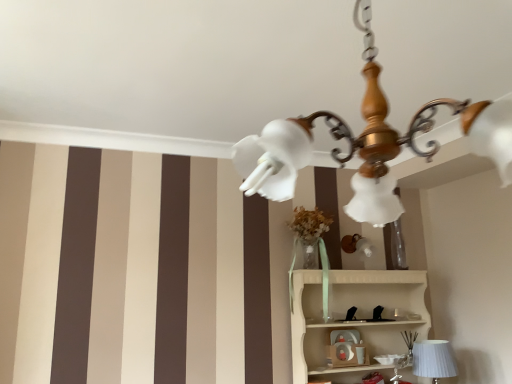
Question: Considering their positions, is wooden chandelier at upper center located in front of or behind matte plastic toy at center?

Choices:
 (A) behind
 (B) front

Answer: (B)

Question: Considering the positions of wooden chandelier at upper center and matte plastic toy at center in the image, is wooden chandelier at upper center bigger or smaller than matte plastic toy at center?

Choices:
 (A) small
 (B) big

Answer: (B)

Question: Which of these objects is positioned closest to the white wood shelf at lower right?

Choices:
 (A) white ribbed fabric at lower right
 (B) wooden chandelier at upper center
 (C) matte plastic toy at center

Answer: (C)

Question: Based on their relative distances, which object is nearer to the wooden chandelier at upper center?

Choices:
 (A) white ribbed fabric at lower right
 (B) white wood shelf at lower right
 (C) matte plastic toy at center

Answer: (B)